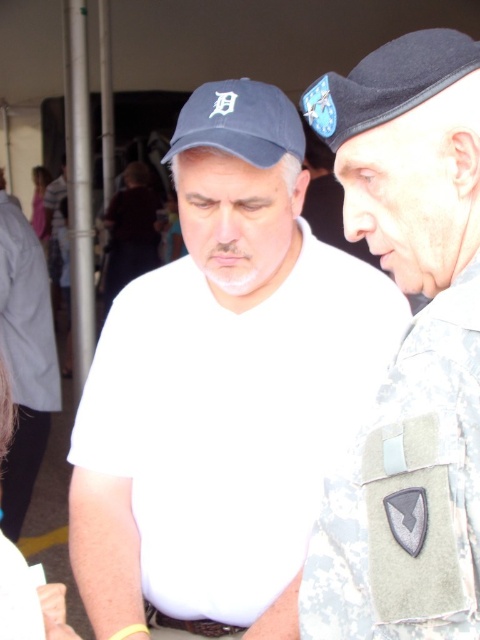
Measure the distance between camouflage fabric uniform at right and light pink fabric at upper left.

The distance of camouflage fabric uniform at right from light pink fabric at upper left is 8.05 meters.

Does camouflage fabric uniform at right come in front of light pink fabric at upper left?

Yes, it is.

Does point (376, 465) come in front of point (45, 214)?

Yes, it is.

Identify the location of camouflage fabric uniform at right. This screenshot has height=640, width=480. (408, 349).

Can you confirm if camouflage fabric uniform at right is thinner than black felt baseball cap at upper center?

Indeed, camouflage fabric uniform at right has a lesser width compared to black felt baseball cap at upper center.

Can you confirm if camouflage fabric uniform at right is smaller than black felt baseball cap at upper center?

Yes, camouflage fabric uniform at right is smaller than black felt baseball cap at upper center.

Which is in front, point (451, 330) or point (477, 58)?

Point (451, 330)

Where is `camouflage fabric uniform at right`? This screenshot has width=480, height=640. camouflage fabric uniform at right is located at coordinates (408, 349).

Between camouflage fabric uniform at right and matte blue baseball cap at center, which one has more height?

With more height is camouflage fabric uniform at right.

Who is positioned more to the left, camouflage fabric uniform at right or matte blue baseball cap at center?

matte blue baseball cap at center is more to the left.

The width and height of the screenshot is (480, 640). Identify the location of camouflage fabric uniform at right. (408, 349).